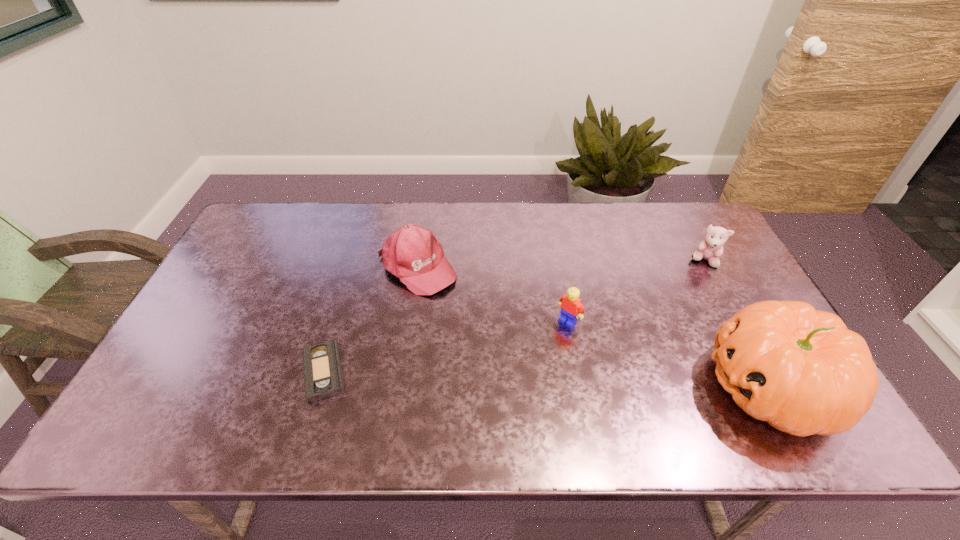
What are the coordinates of `videotape located at the near edge` in the screenshot? It's located at (323, 376).

Locate an element on the screen. This screenshot has height=540, width=960. pumpkin at the near edge is located at coordinates (801, 370).

At what (x,y) coordinates should I click in order to perform the action: click on pumpkin located at the right edge. Please return your answer as a coordinate pair (x, y). The height and width of the screenshot is (540, 960). Looking at the image, I should click on (801, 370).

You are a GUI agent. You are given a task and a screenshot of the screen. Output one action in this format:
    pyautogui.click(x=<x>, y=<y>)
    Task: Click on the teddy bear that is at the right edge
    The height and width of the screenshot is (540, 960).
    Given the screenshot: What is the action you would take?
    pyautogui.click(x=711, y=248)

What are the coordinates of `object located in the near right corner section of the desktop` in the screenshot? It's located at coord(801,370).

This screenshot has height=540, width=960. I want to click on vacant space at the far edge of the desktop, so click(324, 220).

Locate an element on the screen. The height and width of the screenshot is (540, 960). vacant space at the near edge of the desktop is located at coordinates (228, 395).

What are the coordinates of `vacant point at the left edge` in the screenshot? It's located at (264, 276).

Image resolution: width=960 pixels, height=540 pixels. In the image, there is a desktop. What are the coordinates of `vacant space at the far left corner` in the screenshot? It's located at (273, 214).

In order to click on vacant area at the near left corner of the desktop in this screenshot , I will do `click(208, 374)`.